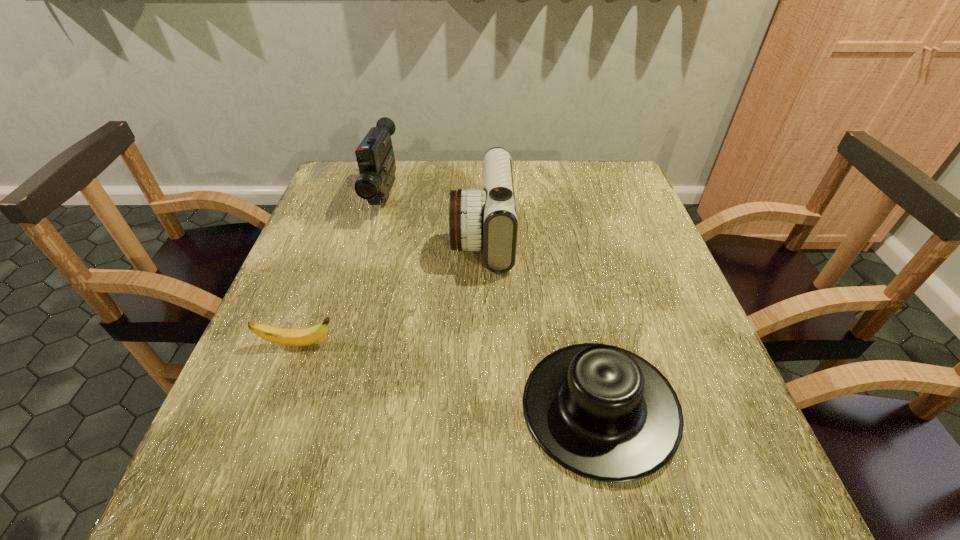
What are the coordinates of `the left camcorder` in the screenshot? It's located at (375, 157).

Where is `the right camcorder`? Image resolution: width=960 pixels, height=540 pixels. the right camcorder is located at coordinates (486, 219).

Identify the location of the third tallest object. The height and width of the screenshot is (540, 960). (602, 412).

This screenshot has width=960, height=540. Find the location of `banana`. banana is located at coordinates (292, 337).

Identify the location of vacant space located on the front-facing side of the left camcorder. (349, 319).

Image resolution: width=960 pixels, height=540 pixels. Identify the location of vacant space located 0.160m on the surface of the right camcorder. (390, 236).

Locate an element on the screen. vacant area situated on the surface of the right camcorder is located at coordinates (346, 236).

The height and width of the screenshot is (540, 960). Find the location of `vacant space situated on the surface of the right camcorder`. vacant space situated on the surface of the right camcorder is located at coordinates (350, 236).

Locate an element on the screen. This screenshot has width=960, height=540. vacant space located on the left of the dress hat is located at coordinates (477, 407).

Image resolution: width=960 pixels, height=540 pixels. Find the location of `vacant space positioned at the stem of the banana`. vacant space positioned at the stem of the banana is located at coordinates (435, 344).